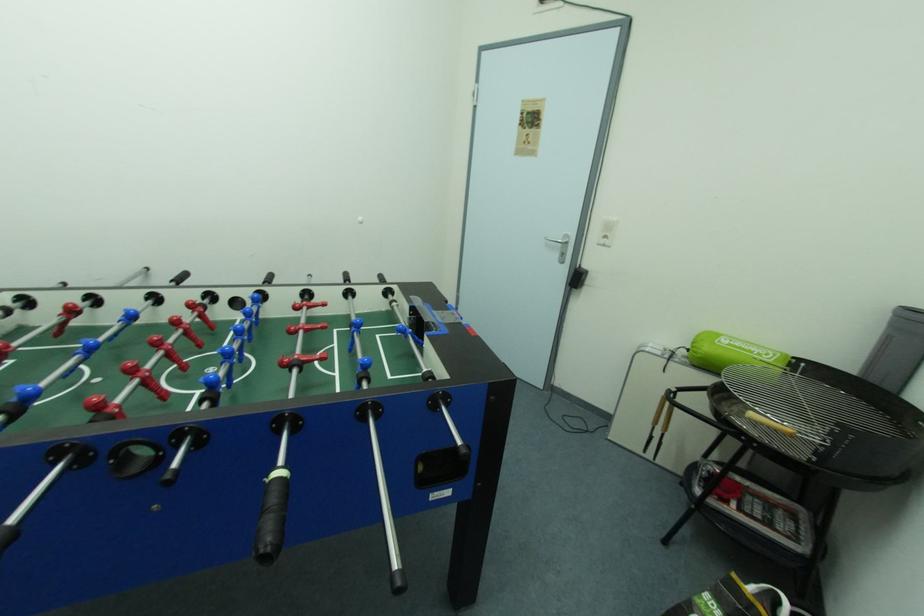
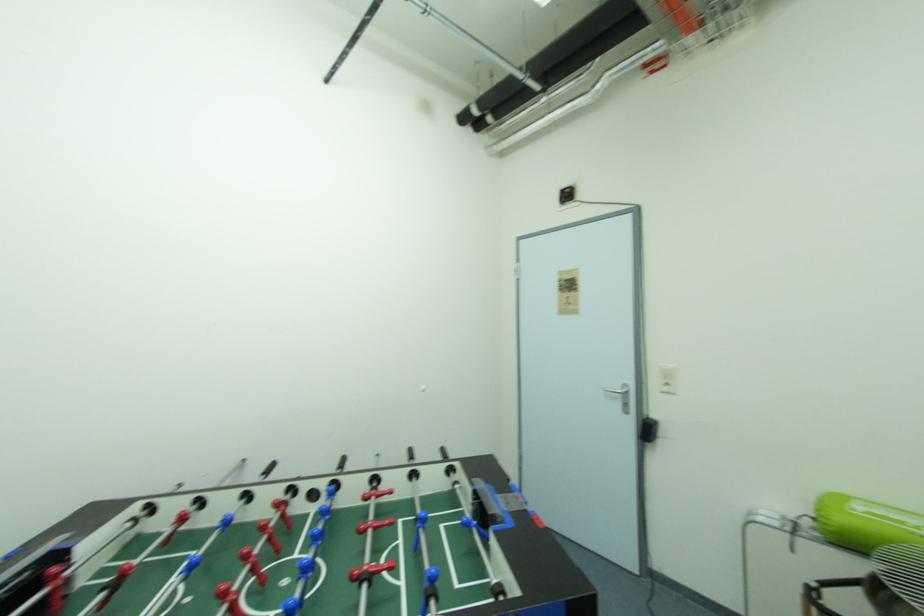
Question: Which direction would the cameraman need to move to produce the second image? Reply with the corresponding letter.

Choices:
 (A) Left
 (B) Right
 (C) Forward
 (D) Backward

Answer: (D)